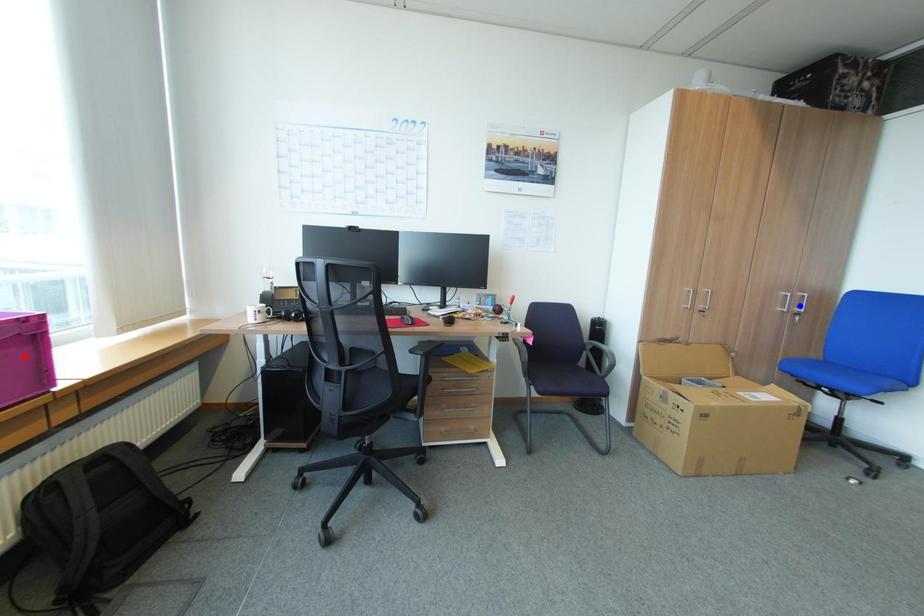
Question: Which of the two points in the image is closer to the camera?

Choices:
 (A) Blue point is closer.
 (B) Red point is closer.

Answer: (B)